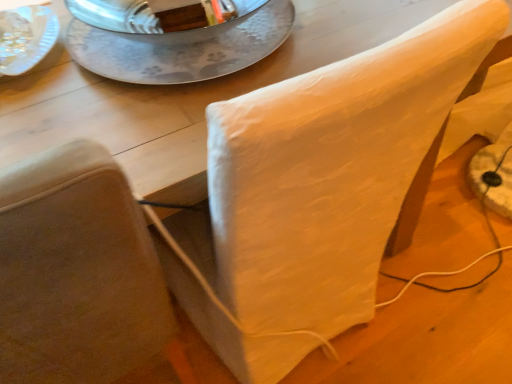
Question: In the image, is white fabric chair at upper right on the left side or the right side of silver textured plate at upper center?

Choices:
 (A) right
 (B) left

Answer: (B)

Question: Is white fabric chair at upper right taller or shorter than silver textured plate at upper center?

Choices:
 (A) tall
 (B) short

Answer: (A)

Question: Is white fabric chair at upper right in front of or behind silver textured plate at upper center in the image?

Choices:
 (A) front
 (B) behind

Answer: (A)

Question: Relative to white fabric chair at upper right, is silver textured plate at upper center in front or behind?

Choices:
 (A) front
 (B) behind

Answer: (B)

Question: From a real-world perspective, is silver textured plate at upper center above or below white fabric chair at upper right?

Choices:
 (A) below
 (B) above

Answer: (B)

Question: From the image's perspective, is silver textured plate at upper center above or below white fabric chair at upper right?

Choices:
 (A) below
 (B) above

Answer: (B)

Question: Is silver textured plate at upper center inside the boundaries of white fabric chair at upper right, or outside?

Choices:
 (A) inside
 (B) outside

Answer: (B)